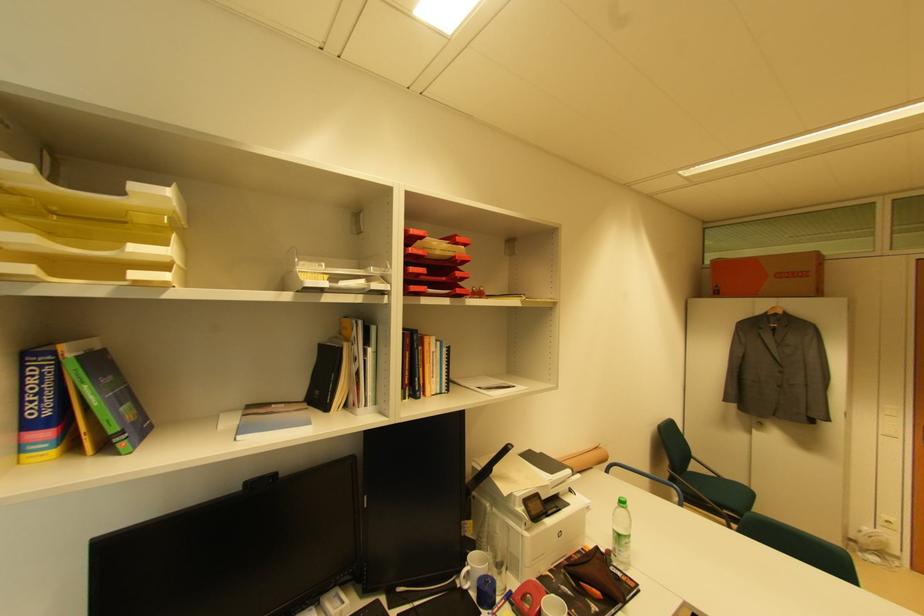
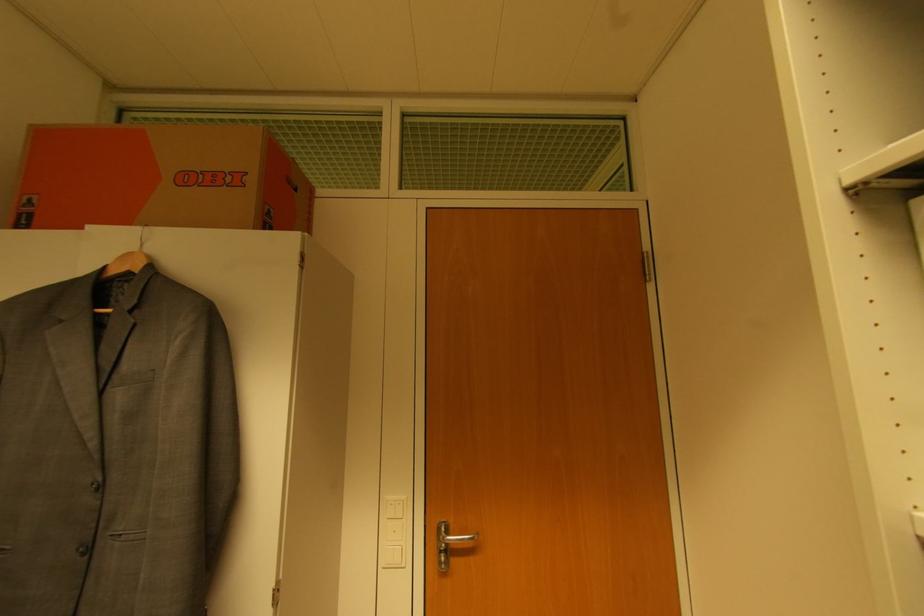
Find the pixel in the second image that matches point (782, 315) in the first image.

(137, 270)